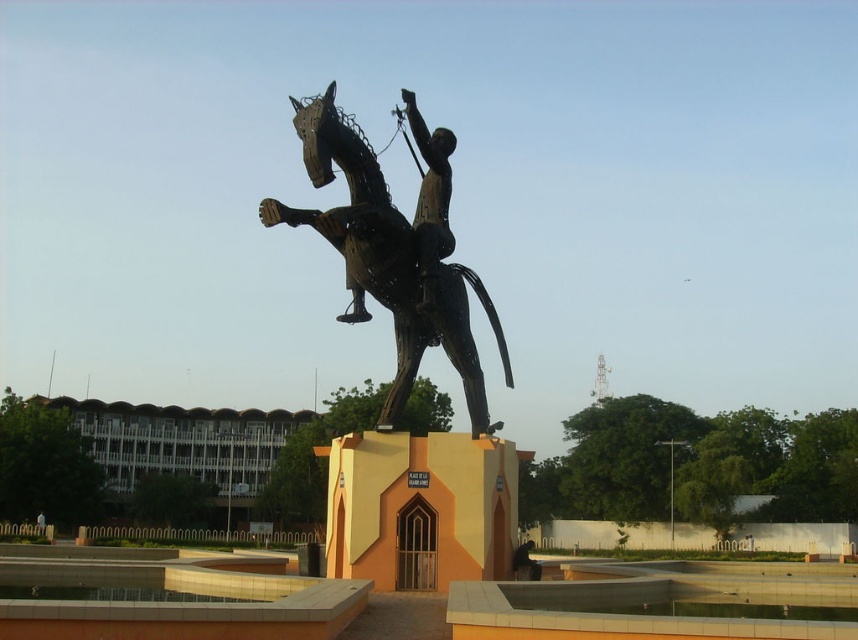
Question: Can you confirm if black metal horseman at center is positioned to the right of polished bronze rider at center?

Choices:
 (A) yes
 (B) no

Answer: (B)

Question: Which object appears closest to the camera in this image?

Choices:
 (A) polished bronze rider at center
 (B) black metal horseman at center

Answer: (B)

Question: Which object is closer to the camera taking this photo?

Choices:
 (A) polished bronze rider at center
 (B) black metal horseman at center

Answer: (B)

Question: Can you confirm if black metal horseman at center is positioned to the right of polished bronze rider at center?

Choices:
 (A) no
 (B) yes

Answer: (A)

Question: Does black metal horseman at center have a greater width compared to polished bronze rider at center?

Choices:
 (A) no
 (B) yes

Answer: (B)